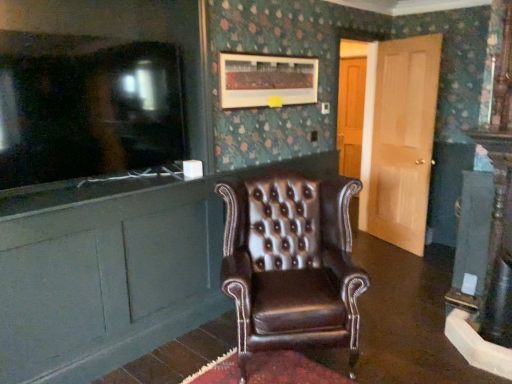
Question: In terms of height, does light brown wood door at right look taller or shorter compared to brown leather cabinet at left?

Choices:
 (A) tall
 (B) short

Answer: (A)

Question: From a real-world perspective, is light brown wood door at right physically located above or below brown leather cabinet at left?

Choices:
 (A) below
 (B) above

Answer: (B)

Question: Based on their relative distances, which object is farther from the wooden picture frame at upper center?

Choices:
 (A) matte black television at left
 (B) light brown wood door at right
 (C) brown leather cabinet at left
 (D) brown leather wingback chair at center

Answer: (B)

Question: Which is nearer to the matte black television at left?

Choices:
 (A) wooden picture frame at upper center
 (B) brown leather wingback chair at center
 (C) brown leather cabinet at left
 (D) light brown wood door at right

Answer: (C)